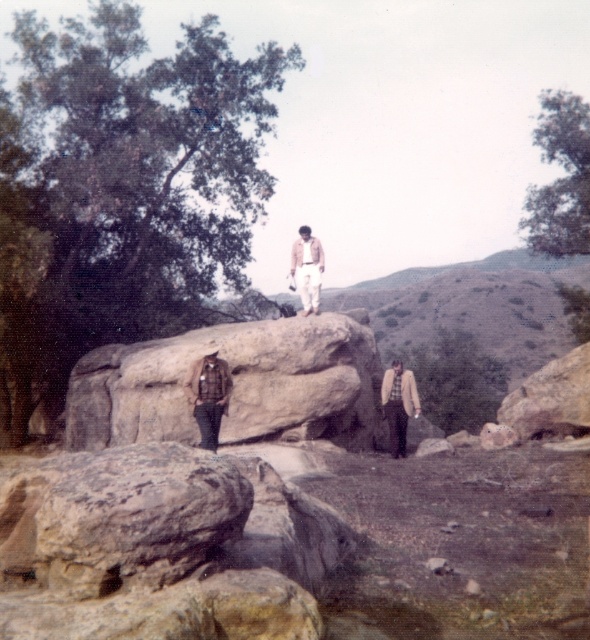
Question: Which point is closer to the camera?

Choices:
 (A) light brown woolen jacket at center
 (B) brown plaid shirt at lower left
 (C) brown leather jacket at center
 (D) rusty stone boulder at lower left

Answer: (D)

Question: Estimate the real-world distances between objects in this image. Which object is closer to the rustic stone boulder at center?

Choices:
 (A) brown plaid shirt at lower left
 (B) light brown woolen jacket at center
 (C) brown leather jacket at center

Answer: (A)

Question: Which point is farther to the camera?

Choices:
 (A) (312, 284)
 (B) (365, 376)
 (C) (404, 371)

Answer: (A)

Question: Is light brown woolen jacket at center to the right of brown leather jacket at center from the viewer's perspective?

Choices:
 (A) no
 (B) yes

Answer: (B)

Question: In this image, where is rusty stone boulder at lower left located relative to rustic stone boulder at center?

Choices:
 (A) right
 (B) left

Answer: (A)

Question: Is rustic stone boulder at center thinner than brown leather jacket at center?

Choices:
 (A) no
 (B) yes

Answer: (A)